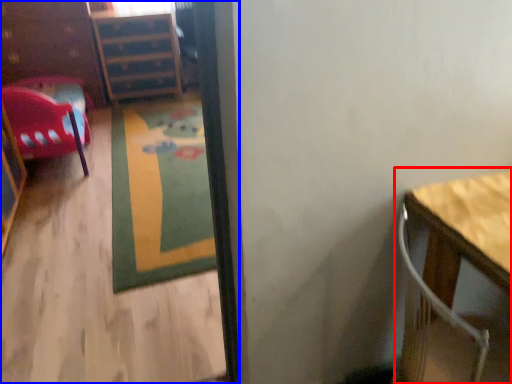
Question: Which object appears closest to the camera in this image, table (highlighted by a red box) or corridor (highlighted by a blue box)?

Choices:
 (A) table
 (B) corridor

Answer: (B)